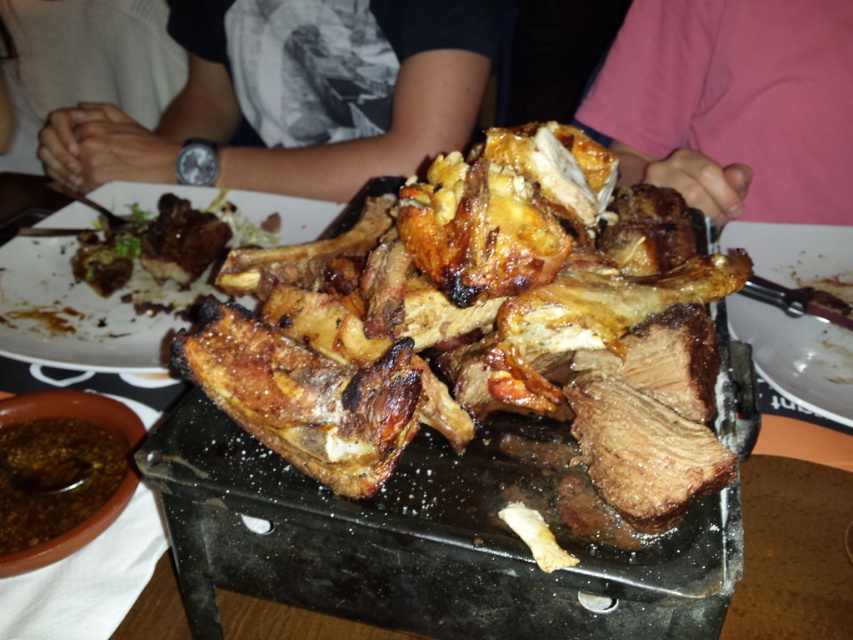
Is brown crispy ribs at center above slightly charred bone at center?

Actually, brown crispy ribs at center is below slightly charred bone at center.

Is point (662, 388) closer to viewer compared to point (292, 225)?

That is True.

Measure the distance between point (415, 244) and camera.

A distance of 15.62 inches exists between point (415, 244) and camera.

What are the coordinates of `brown crispy ribs at center` in the screenshot? It's located at (480, 324).

Does black printed shirt at upper center appear on the left side of brown charred meat at center?

Yes, black printed shirt at upper center is to the left of brown charred meat at center.

Does black printed shirt at upper center have a greater width compared to brown charred meat at center?

Yes, black printed shirt at upper center is wider than brown charred meat at center.

Is point (194, 35) positioned in front of point (732, 240)?

No, (194, 35) is behind (732, 240).

You are a GUI agent. You are given a task and a screenshot of the screen. Output one action in this format:
    pyautogui.click(x=<x>, y=<y>)
    Task: Click on the black printed shirt at upper center
    
    Given the screenshot: What is the action you would take?
    pyautogui.click(x=297, y=97)

Between brown crispy ribs at center and brown charred meat at center, which one appears on the right side from the viewer's perspective?

brown charred meat at center is more to the right.

Does brown crispy ribs at center appear on the right side of brown charred meat at center?

In fact, brown crispy ribs at center is to the left of brown charred meat at center.

Is point (229, 280) positioned behind point (770, 324)?

No.

This screenshot has width=853, height=640. I want to click on brown crispy ribs at center, so click(480, 324).